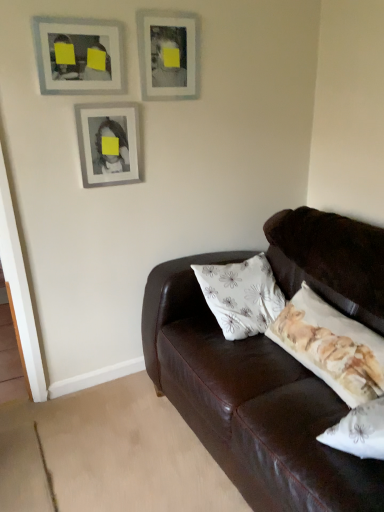
Question: Based on their sizes in the image, would you say matte gray picture frame at upper left, positioned as the first picture frame in left-to-right order, is bigger or smaller than matte silver picture frame at upper center, which is the third picture frame in left-to-right order?

Choices:
 (A) big
 (B) small

Answer: (B)

Question: Considering the positions of matte gray picture frame at upper left, positioned as the first picture frame in left-to-right order, and matte silver picture frame at upper center, which is the third picture frame in left-to-right order, in the image, is matte gray picture frame at upper left, positioned as the first picture frame in left-to-right order, taller or shorter than matte silver picture frame at upper center, which is the third picture frame in left-to-right order,?

Choices:
 (A) short
 (B) tall

Answer: (A)

Question: Estimate the real-world distances between objects in this image. Which object is farther from the matte silver picture frame at center, which is counted as the second picture frame, starting from the right?

Choices:
 (A) matte gray picture frame at upper left, positioned as the first picture frame in left-to-right order
 (B) matte silver picture frame at upper center, which is the 1th picture frame from right to left

Answer: (B)

Question: Based on their relative distances, which object is nearer to the matte silver picture frame at center, which is counted as the second picture frame, starting from the left?

Choices:
 (A) matte silver picture frame at upper center, which is the 1th picture frame from right to left
 (B) matte gray picture frame at upper left, positioned as the first picture frame in left-to-right order

Answer: (B)